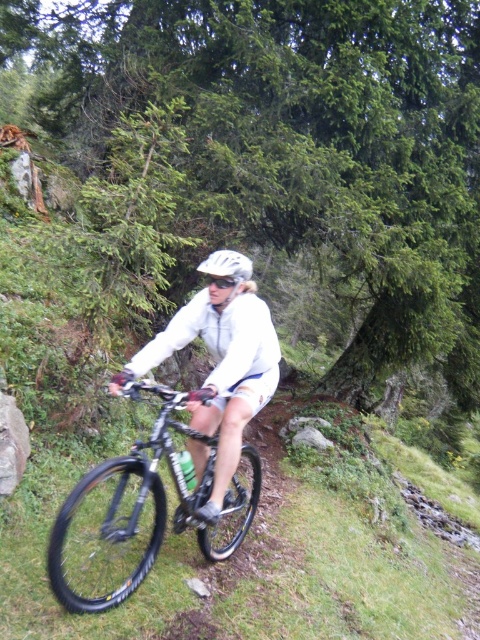
You are a photographer trying to capture the cyclist and their gear. You want to ensure that both the shiny metallic bicycle at center and the white matte bicycle helmet at center are clearly visible in your photo. Considering their heights, which object might require you to adjust your camera angle to avoid being blocked by the other?

The shiny metallic bicycle at center is taller than the white matte bicycle helmet at center. Therefore, the white matte bicycle helmet at center might be partially obscured if the bicycle is positioned in front of it. To ensure both are visible, you should adjust your camera angle to account for the bicycle being taller.

You are a photographer positioned on the grassy trail and want to capture a photo of both the shiny metallic bicycle at center and the white matte bicycle helmet at center. Since you can only focus on one object at a time, which object should you focus on first if you want to ensure both are in the frame without moving the camera?

You should focus on the shiny metallic bicycle at center first because it is positioned to the left of the white matte bicycle helmet at center, so by centering the bicycle in the frame first, you can adjust the camera to include both objects without needing to reposition.